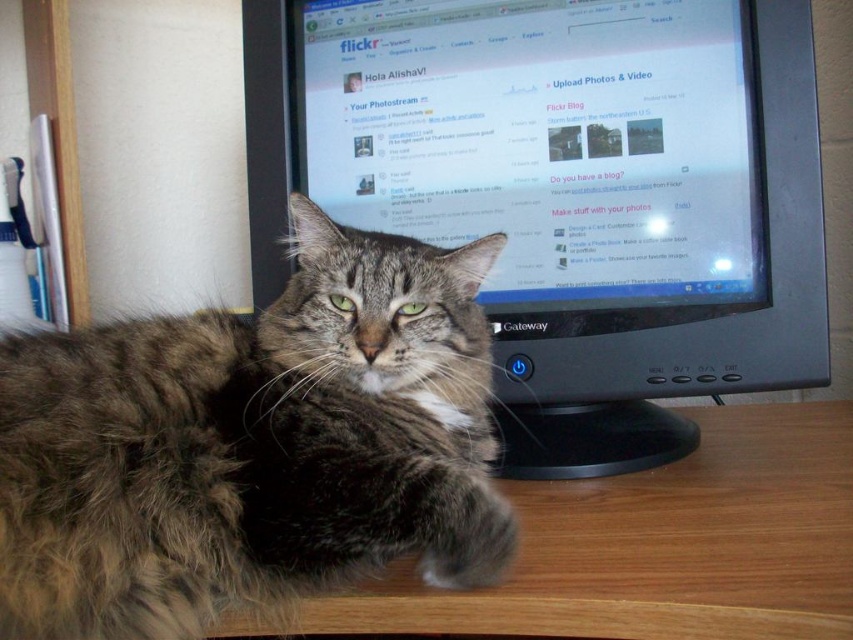
You are a photographer trying to take a picture of the gray tabby cat at center and the wooden at lower left. Which object is positioned higher in the image?

The gray tabby cat at center is positioned higher than the wooden at lower left.

You are a photographer trying to set up a lighting setup for a photo shoot. You need to place a small reflector to bounce light onto the cat. The reflector must be placed at a specific coordinate to ensure optimal lighting. The coordinate given is point (567,192). Based on the scene description, where exactly should you place the reflector?

The point (567,192) marks the black plastic monitor at center, so you should place the reflector near the black plastic monitor at center to achieve optimal lighting.